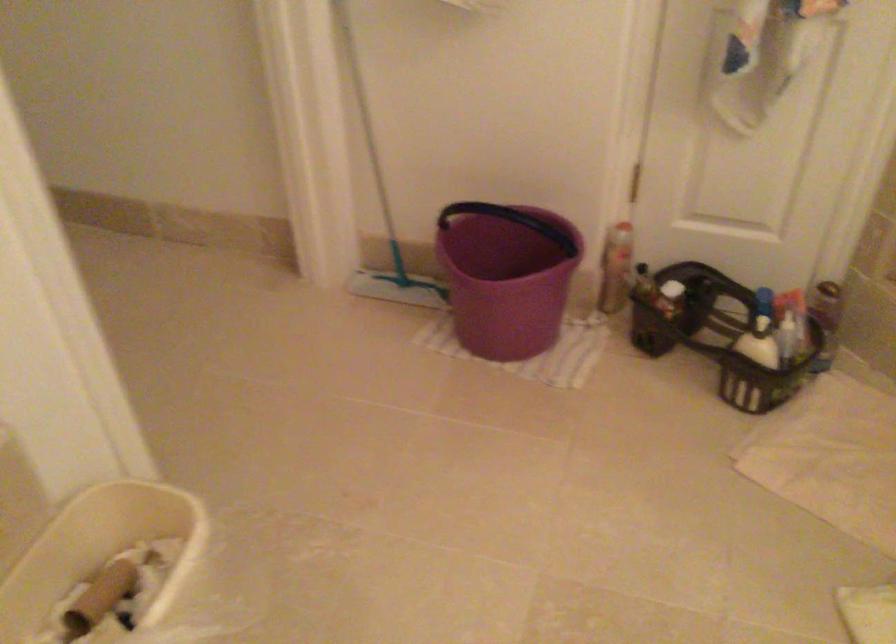
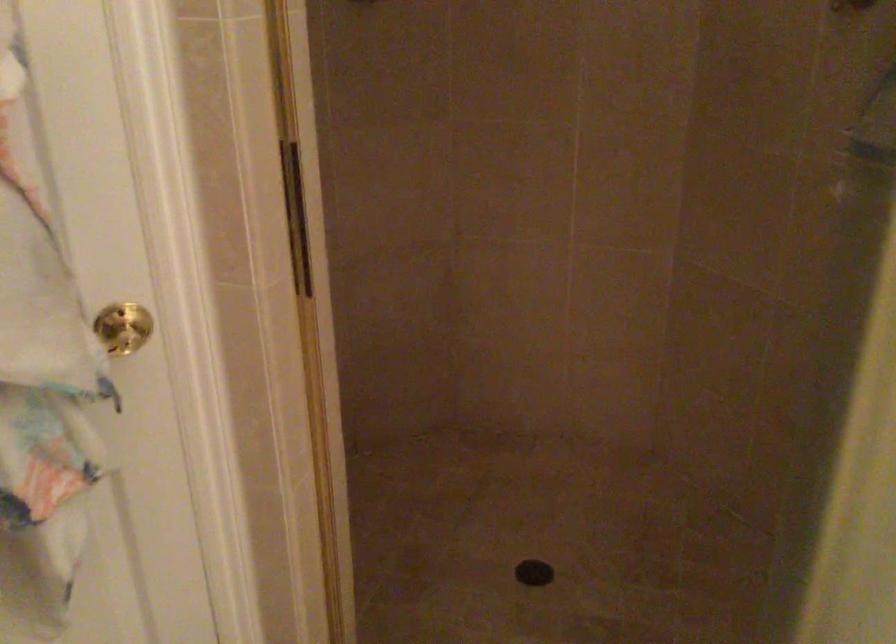
Question: How did the camera likely rotate?

Choices:
 (A) Left
 (B) Right
 (C) Up
 (D) Down

Answer: (B)